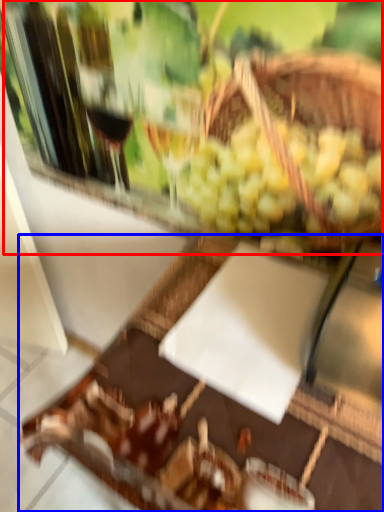
Question: Among these objects, which one is farthest to the camera, wine tasting (highlighted by a red box) or table (highlighted by a blue box)?

Choices:
 (A) wine tasting
 (B) table

Answer: (A)